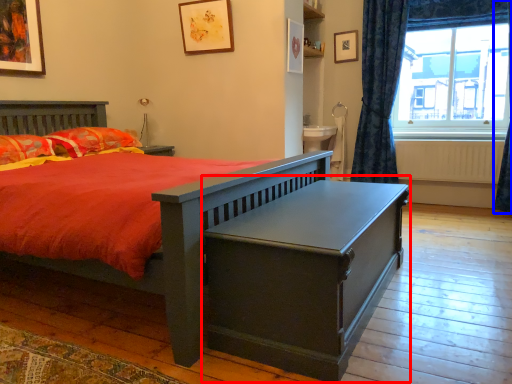
Question: Among these objects, which one is nearest to the camera, table (highlighted by a red box) or curtain (highlighted by a blue box)?

Choices:
 (A) table
 (B) curtain

Answer: (A)